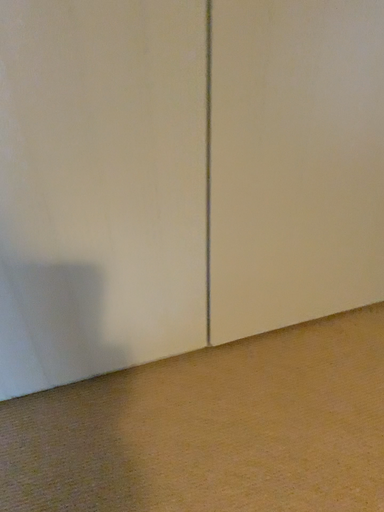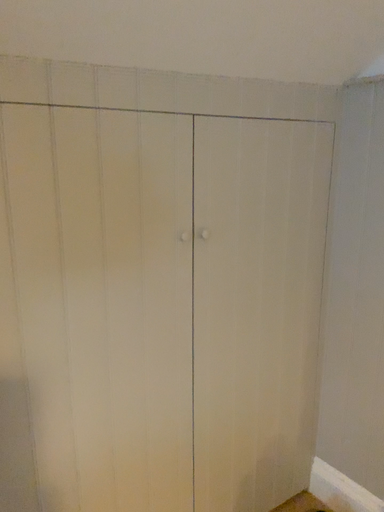
Question: Which way did the camera rotate in the video?

Choices:
 (A) rotated right
 (B) rotated left

Answer: (A)